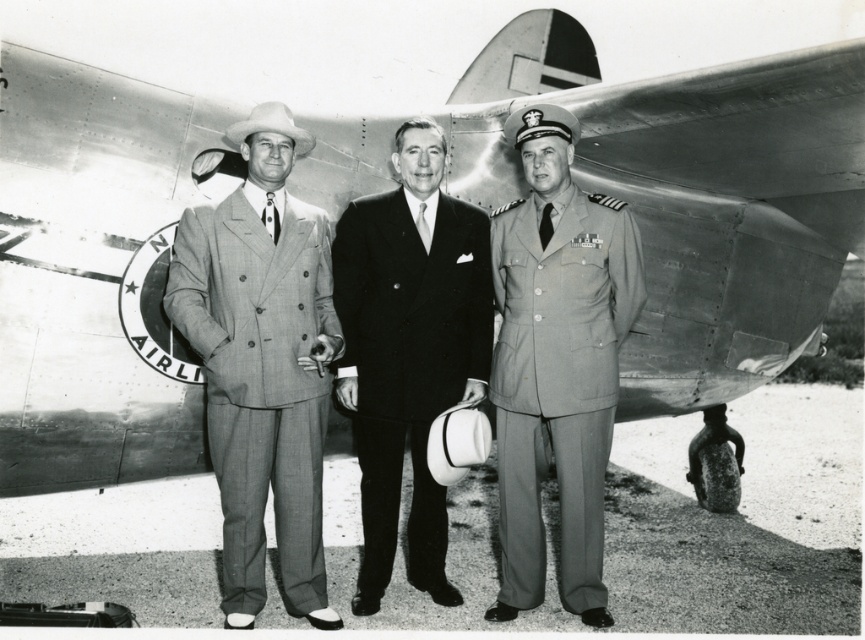
Is point (234, 134) positioned in front of point (369, 516)?

Yes, point (234, 134) is in front of point (369, 516).

Does plaid wool suit at center appear over smooth black suit at center?

Yes.

From the picture: Who is more distant from viewer, (304, 605) or (364, 374)?

Point (364, 374)

At what (x,y) coordinates should I click in order to perform the action: click on plaid wool suit at center. Please return your answer as a coordinate pair (x, y). The width and height of the screenshot is (865, 640). Looking at the image, I should click on (261, 364).

Who is positioned more to the left, matte gray uniform at center or smooth black suit at center?

Positioned to the left is smooth black suit at center.

Between matte gray uniform at center and smooth black suit at center, which one has less height?

With less height is smooth black suit at center.

Is point (561, 532) positioned after point (421, 432)?

Yes, it is.

Image resolution: width=865 pixels, height=640 pixels. What are the coordinates of `matte gray uniform at center` in the screenshot? It's located at (556, 362).

Which is more to the left, plaid wool suit at center or matte gray uniform at center?

plaid wool suit at center is more to the left.

Can you confirm if plaid wool suit at center is positioned to the left of matte gray uniform at center?

Yes, plaid wool suit at center is to the left of matte gray uniform at center.

Where is `plaid wool suit at center`? The width and height of the screenshot is (865, 640). plaid wool suit at center is located at coordinates (261, 364).

Locate an element on the screen. plaid wool suit at center is located at coordinates (261, 364).